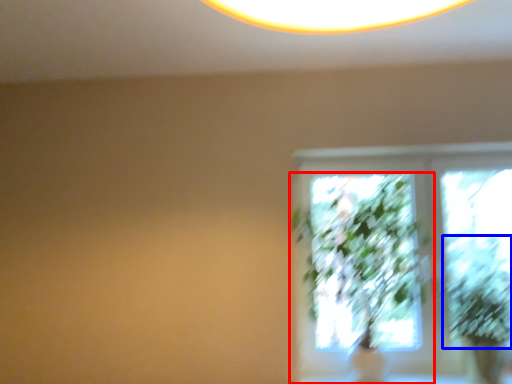
Question: Which of the following is the closest to the observer, houseplant (highlighted by a red box) or plant (highlighted by a blue box)?

Choices:
 (A) houseplant
 (B) plant

Answer: (A)